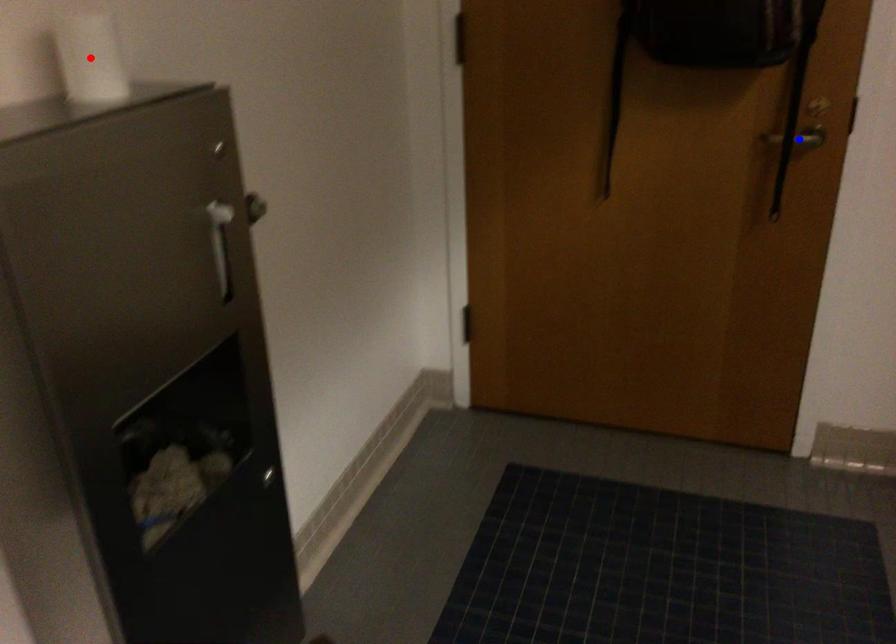
Question: Two points are marked on the image. Which point is closer to the camera?

Choices:
 (A) Blue point is closer.
 (B) Red point is closer.

Answer: (B)